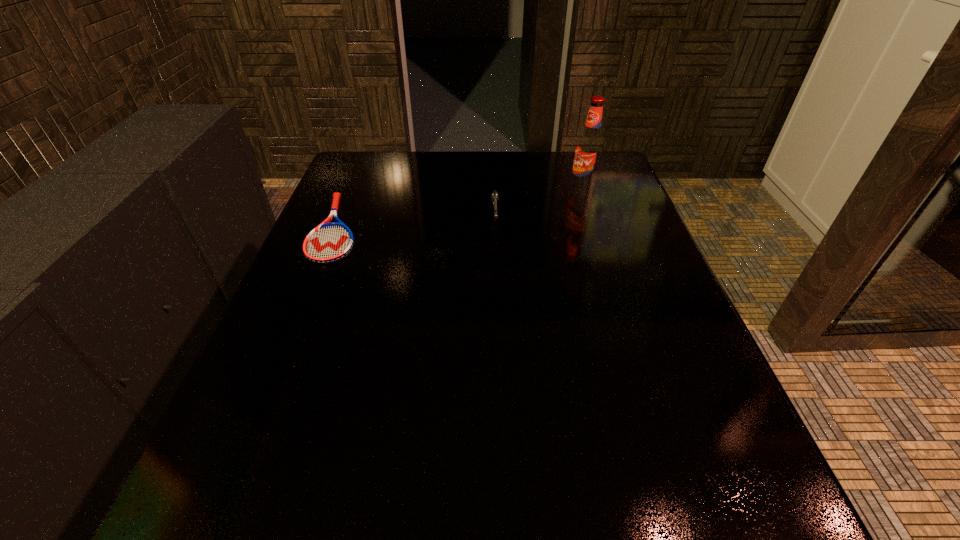
Find the location of `vacant space that is in between the tallest object and the shortest object`. vacant space that is in between the tallest object and the shortest object is located at coordinates (460, 208).

The width and height of the screenshot is (960, 540). I want to click on empty space between the pistol and the root beer, so click(x=539, y=203).

Find the location of a particular element. This screenshot has height=540, width=960. free space between the leftmost object and the second tallest object is located at coordinates (416, 223).

Where is `vacant area that lies between the leftmost object and the pistol`? The image size is (960, 540). vacant area that lies between the leftmost object and the pistol is located at coordinates (416, 223).

The image size is (960, 540). Identify the location of free space that is in between the second object from right to left and the root beer. (539, 203).

This screenshot has height=540, width=960. I want to click on blank region between the rightmost object and the pistol, so click(539, 203).

The width and height of the screenshot is (960, 540). Identify the location of empty location between the second tallest object and the shortest object. (416, 223).

Where is `vacant area between the shortest object and the farthest object`? Image resolution: width=960 pixels, height=540 pixels. vacant area between the shortest object and the farthest object is located at coordinates (460, 208).

Find the location of `blank region between the leftmost object and the second shortest object`. blank region between the leftmost object and the second shortest object is located at coordinates (416, 223).

Locate an element on the screen. The image size is (960, 540). free point between the shortest object and the pistol is located at coordinates (x=416, y=223).